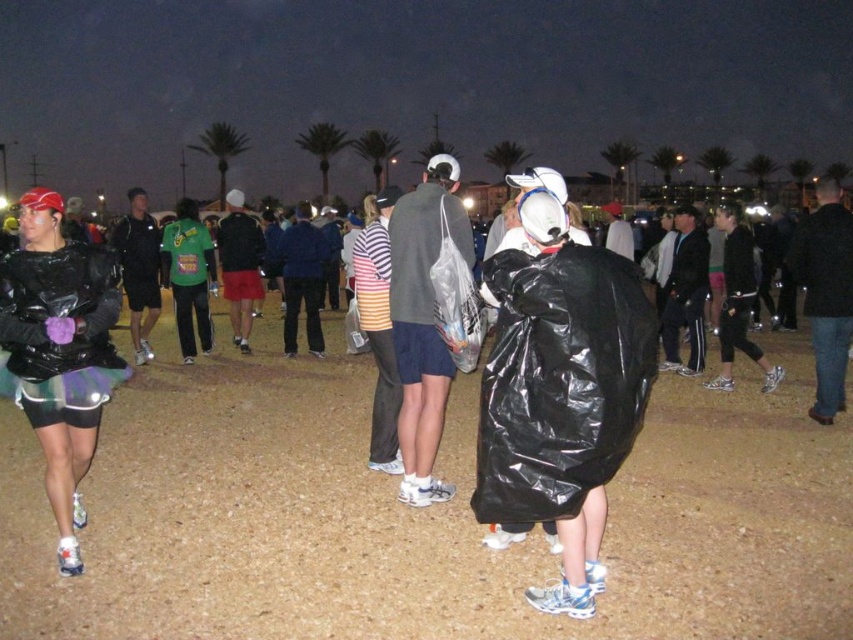
You are organizing a cleanup at the event and need to decide which item to collect first. The black plastic bag at center and the matte black jacket at left are both in your path. Which item is larger and should be prioritized for easier handling?

The black plastic bag at center is bigger than the matte black jacket at left, so it should be prioritized for easier handling.

You are at an outdoor event and need to store a large item temporarily. You see a black plastic bag at center and a matte black jacket at left. Which object can accommodate a taller item?

The black plastic bag at center is much taller than the matte black jacket at left, so it can accommodate a taller item.

You are at a nighttime event and need to retrieve an item from the ground. You see a black plastic bag at center and a matte gray jacket at center. Which item is positioned to the right of the other?

The black plastic bag at center is to the right of the matte gray jacket at center.